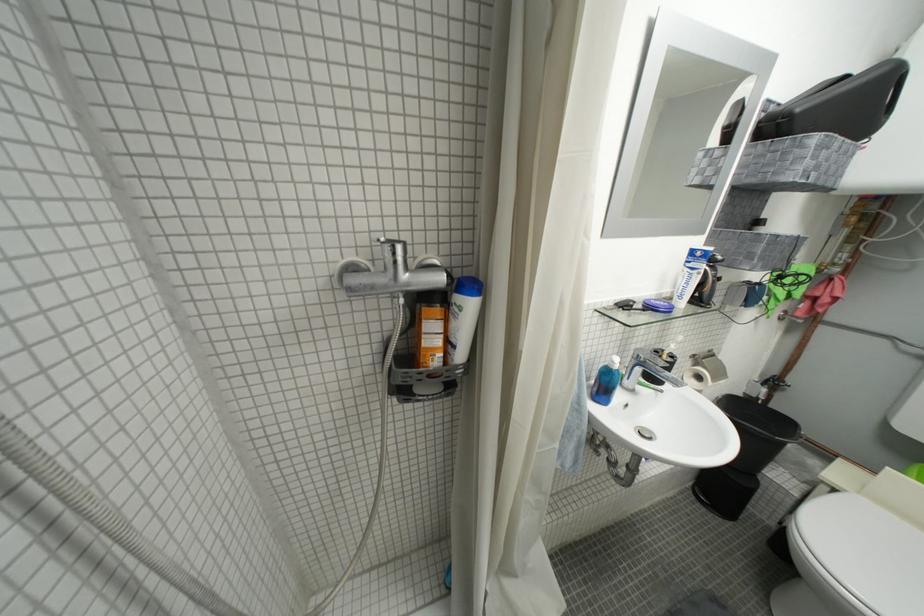
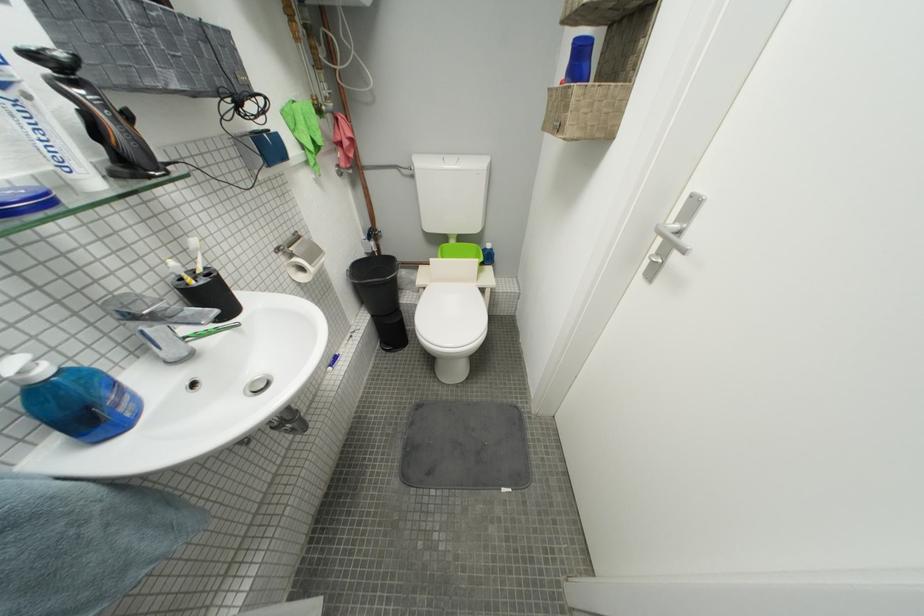
Find the pixel in the second image that matches point (723, 381) in the first image.

(320, 265)